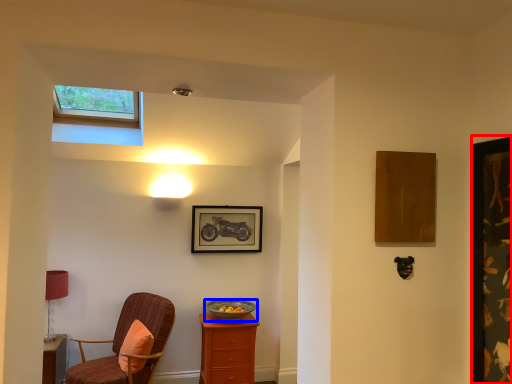
Question: Among these objects, which one is farthest to the camera, picture frame (highlighted by a red box) or bowl (highlighted by a blue box)?

Choices:
 (A) picture frame
 (B) bowl

Answer: (B)